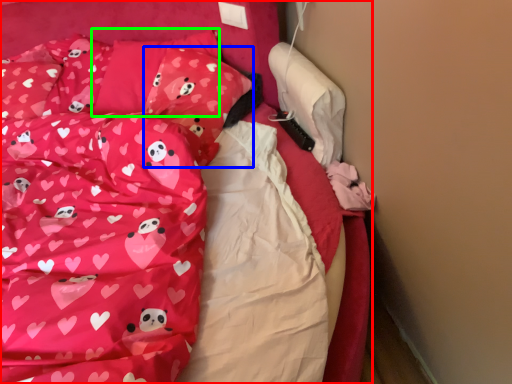
Question: Based on their relative distances, which object is farther from bed (highlighted by a red box)? Choose from pillow (highlighted by a blue box) and pillow (highlighted by a green box).

Choices:
 (A) pillow
 (B) pillow

Answer: (B)